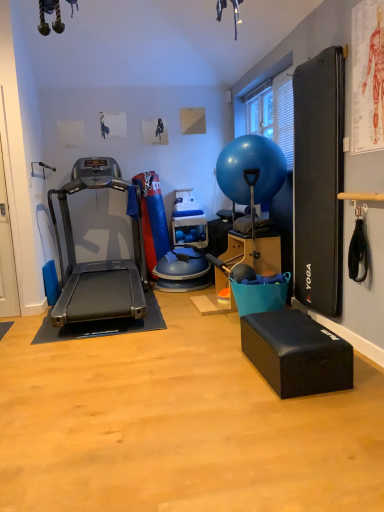
This screenshot has width=384, height=512. Identify the location of unoccupied area in front of black foam footrest at lower right. (304, 419).